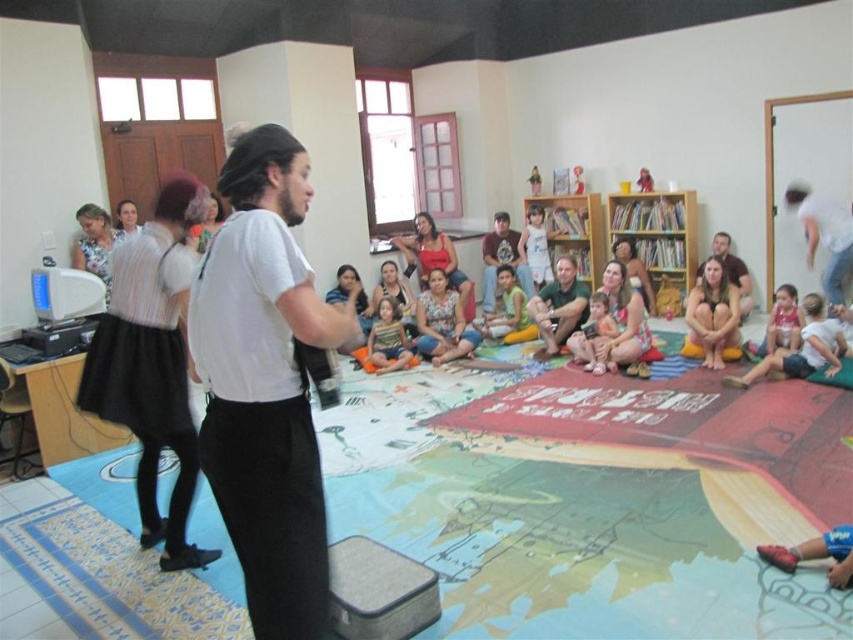
You are a photographer in the room and want to take a photo of the white cotton shirt at center without the pink fabric at center appearing in the background. Is this possible based on their positions?

The white cotton shirt at center is in front of the pink fabric at center, so yes, you can take a photo of the white cotton shirt at center without the pink fabric at center appearing in the background by focusing on the front position of the shirt.

You are standing in the room and want to approach the matte green shirt at center. Which direction should you move relative to the speaker?

The matte green shirt at center is located at point (x=560, y=307), so you should move towards the center of the room to reach it.